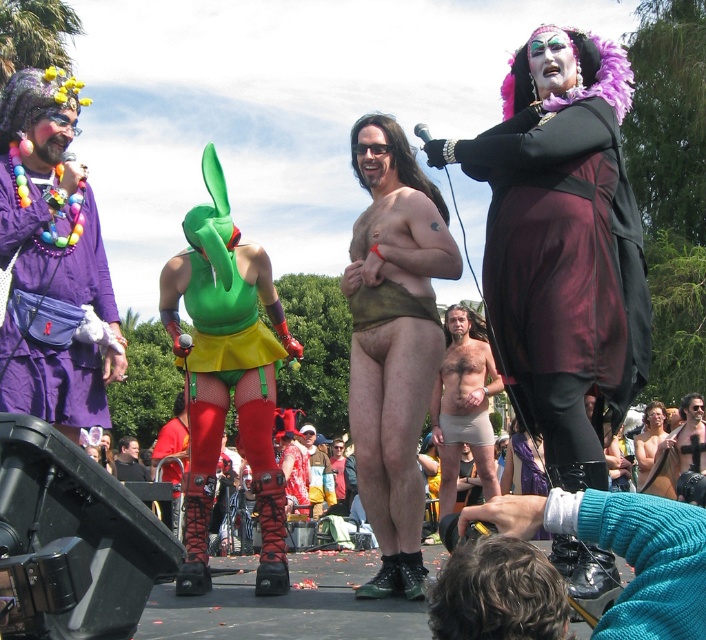
Question: Is velvet maroon dress at upper right to the right of purple fabric fanny pack at left from the viewer's perspective?

Choices:
 (A) yes
 (B) no

Answer: (A)

Question: Is purple fabric fanny pack at left wider than skinny beige shorts at center?

Choices:
 (A) no
 (B) yes

Answer: (A)

Question: Which of these objects is positioned farthest from the velvet maroon dress at upper right?

Choices:
 (A) skinny beige shorts at center
 (B) purple fabric fanny pack at left
 (C) shiny metallic shorts at center
 (D) brown leather shorts at center

Answer: (C)

Question: Does velvet maroon dress at upper right come behind purple fabric fanny pack at left?

Choices:
 (A) yes
 (B) no

Answer: (B)

Question: Which point appears closest to the camera in this image?

Choices:
 (A) (490, 362)
 (B) (107, 426)
 (C) (373, 179)

Answer: (B)

Question: Which point is farther to the camera?

Choices:
 (A) (443, 465)
 (B) (409, 256)
 (C) (76, 268)
 (D) (616, 323)

Answer: (A)